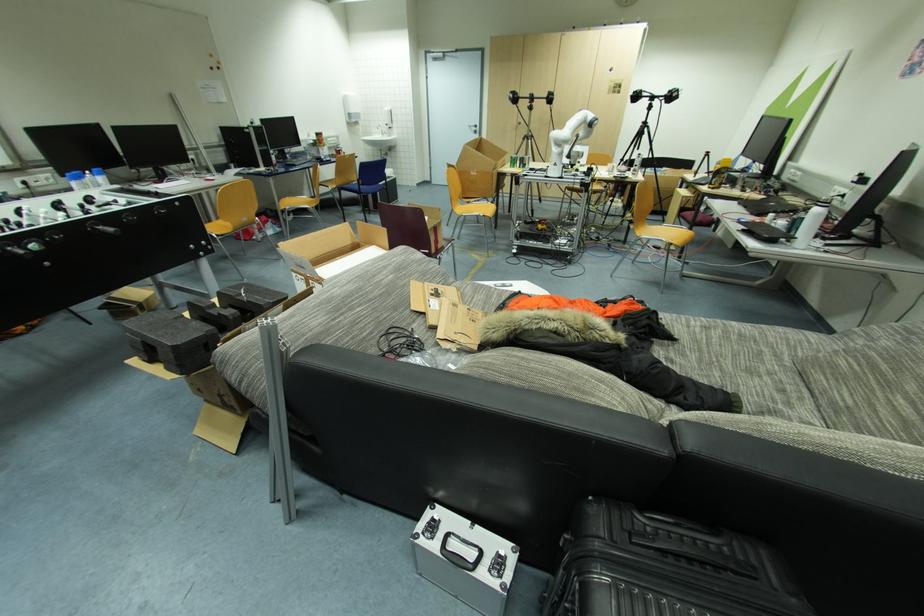
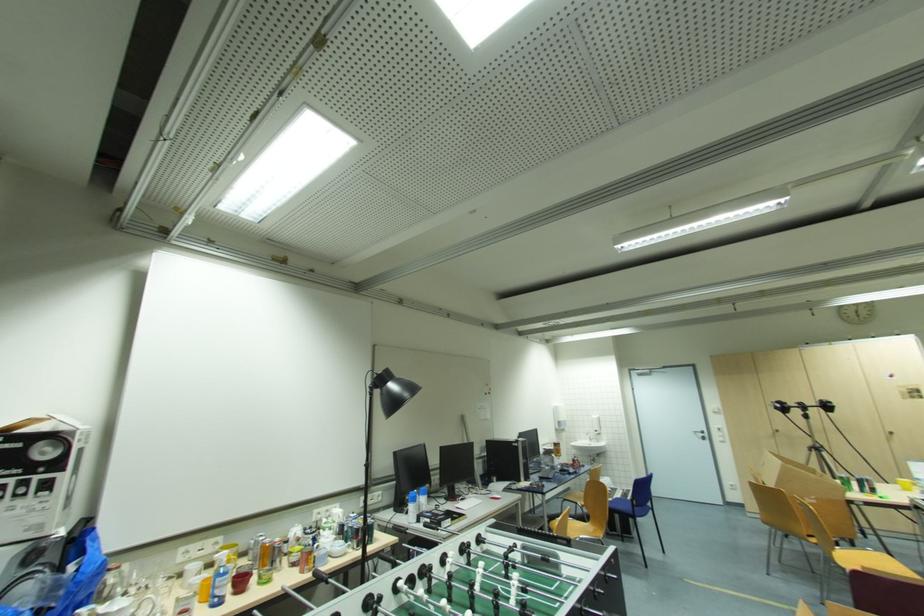
Locate, in the second image, the point that corresponds to the point at 478,130 in the first image.

(706, 436)